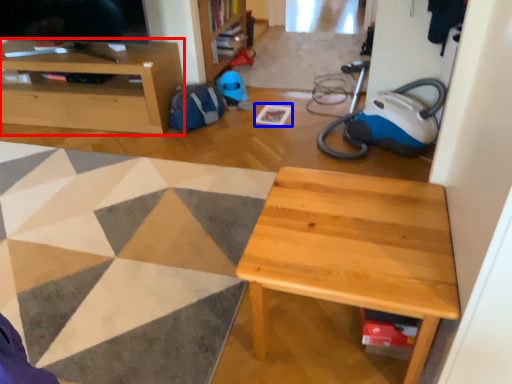
Question: Which point is further to the camera, cabinetry (highlighted by a red box) or square (highlighted by a blue box)?

Choices:
 (A) cabinetry
 (B) square

Answer: (B)